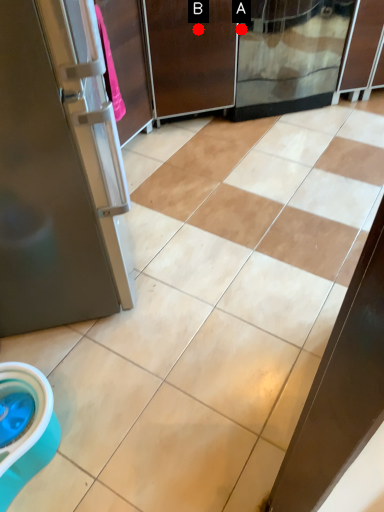
Question: Two points are circled on the image, labeled by A and B beside each circle. Which point appears closest to the camera in this image?

Choices:
 (A) A is closer
 (B) B is closer

Answer: (B)